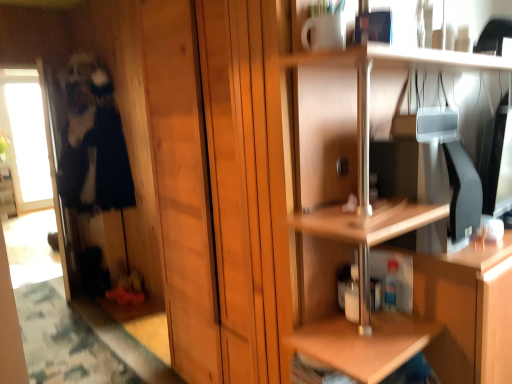
The image size is (512, 384). Identify the location of wooden shelf at upper right. (453, 317).

Between wooden shelf at upper right and dark blue fabric at left, which one has smaller size?

With smaller size is dark blue fabric at left.

Considering the sizes of objects wooden shelf at upper right and dark blue fabric at left in the image provided, who is shorter, wooden shelf at upper right or dark blue fabric at left?

Standing shorter between the two is wooden shelf at upper right.

Is wooden shelf at upper right at the left side of dark blue fabric at left?

Incorrect, wooden shelf at upper right is not on the left side of dark blue fabric at left.

Is dark blue fabric at left with wooden shelf at upper right?

No, dark blue fabric at left is not touching wooden shelf at upper right.

Between dark blue fabric at left and wooden shelf at upper right, which one has smaller width?

Thinner between the two is wooden shelf at upper right.

Which object is closer to the camera, dark blue fabric at left or wooden shelf at upper right?

wooden shelf at upper right.

Measure the distance from dark blue fabric at left to transparent glass screen door at left.

They are 12.40 inches apart.

Are dark blue fabric at left and transparent glass screen door at left making contact?

No, dark blue fabric at left is not touching transparent glass screen door at left.

From a real-world perspective, does dark blue fabric at left sit lower than transparent glass screen door at left?

No, from a real-world perspective, dark blue fabric at left is not below transparent glass screen door at left.

Would you say dark blue fabric at left is inside or outside transparent glass screen door at left?

dark blue fabric at left cannot be found inside transparent glass screen door at left.

Considering the positions of objects transparent glass screen door at left and wooden shelf at upper right in the image provided, who is more to the left, transparent glass screen door at left or wooden shelf at upper right?

transparent glass screen door at left.

Is point (52, 138) closer or farther from the camera than point (467, 274)?

Clearly, point (52, 138) is more distant from the camera than point (467, 274).

Is transparent glass screen door at left surrounding wooden shelf at upper right?

That's incorrect, wooden shelf at upper right is not inside transparent glass screen door at left.

Can you confirm if transparent glass screen door at left is thinner than wooden shelf at upper right?

Yes.

Which point is more distant from viewer, (68, 261) or (100, 141)?

The point (68, 261) is farther.

Considering the relative sizes of transparent glass screen door at left and dark blue fabric at left in the image provided, is transparent glass screen door at left smaller than dark blue fabric at left?

Indeed, transparent glass screen door at left has a smaller size compared to dark blue fabric at left.

How many degrees apart are the facing directions of transparent glass screen door at left and dark blue fabric at left?

There is a 14.5-degree angle between the facing directions of transparent glass screen door at left and dark blue fabric at left.

Is transparent glass screen door at left behind dark blue fabric at left?

Yes, transparent glass screen door at left is further from the camera.

Is wooden shelf at upper right oriented towards transparent glass screen door at left?

No, wooden shelf at upper right is not facing towards transparent glass screen door at left.

Would you say wooden shelf at upper right is inside or outside transparent glass screen door at left?

wooden shelf at upper right is located beyond the bounds of transparent glass screen door at left.

Considering the relative sizes of wooden shelf at upper right and transparent glass screen door at left in the image provided, is wooden shelf at upper right bigger than transparent glass screen door at left?

Yes, wooden shelf at upper right is bigger than transparent glass screen door at left.

You are a GUI agent. You are given a task and a screenshot of the screen. Output one action in this format:
    pyautogui.click(x=<x>, y=<y>)
    Task: Click on the shelf lying below the dark blue fabric at left (from the image's perspective)
    The width and height of the screenshot is (512, 384).
    Given the screenshot: What is the action you would take?
    pyautogui.click(x=453, y=317)

Identify the location of shelf that appears in front of the dark blue fabric at left. (453, 317).

Estimate the real-world distances between objects in this image. Which object is closer to dark blue fabric at left, transparent glass screen door at left or wooden shelf at upper right?

transparent glass screen door at left.

Considering their positions, is wooden shelf at upper right positioned closer to transparent glass screen door at left than dark blue fabric at left?

Based on the image, dark blue fabric at left appears to be nearer to transparent glass screen door at left.

Looking at this image, considering their positions, is dark blue fabric at left positioned closer to wooden shelf at upper right than transparent glass screen door at left?

dark blue fabric at left lies closer to wooden shelf at upper right than the other object.

When comparing their distances from transparent glass screen door at left, does dark blue fabric at left or wooden shelf at upper right seem closer?

dark blue fabric at left.

Considering their positions, is transparent glass screen door at left positioned further to wooden shelf at upper right than dark blue fabric at left?

transparent glass screen door at left lies further to wooden shelf at upper right than the other object.

Considering their positions, is wooden shelf at upper right positioned closer to dark blue fabric at left than transparent glass screen door at left?

transparent glass screen door at left is closer to dark blue fabric at left.

Locate an element on the screen. This screenshot has width=512, height=384. person between wooden shelf at upper right and transparent glass screen door at left from front to back is located at coordinates (92, 141).